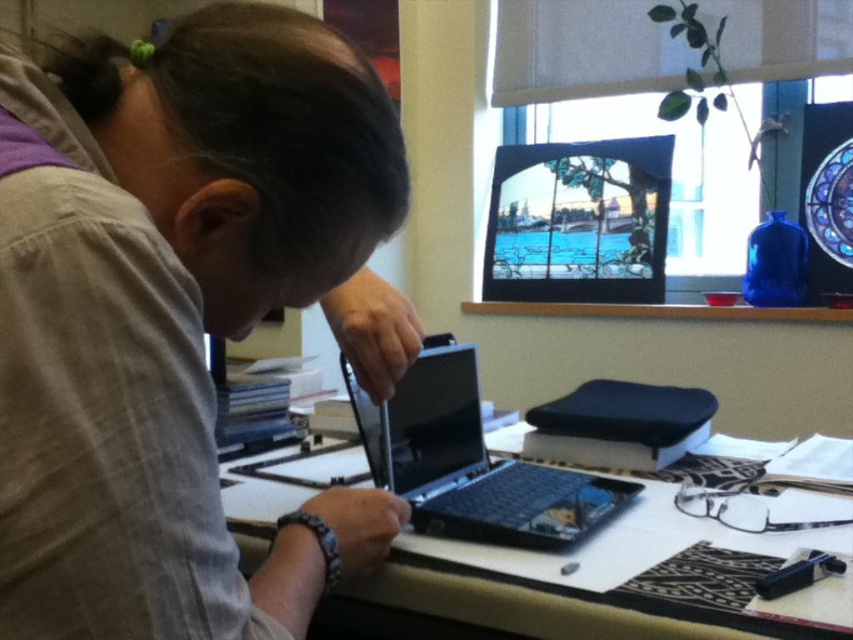
Can you confirm if black plastic laptop at center is taller than smooth wooden table at center?

Yes, black plastic laptop at center is taller than smooth wooden table at center.

Between black plastic laptop at center and smooth wooden table at center, which one has less height?

smooth wooden table at center is shorter.

Locate an element on the screen. The image size is (853, 640). black plastic laptop at center is located at coordinates (471, 461).

Where is `black plastic laptop at center`? black plastic laptop at center is located at coordinates (471, 461).

Which is more to the left, black plastic laptop at center or matte glass computer screen at upper center?

From the viewer's perspective, black plastic laptop at center appears more on the left side.

From the picture: Who is more forward, (448,428) or (663,150)?

Point (448,428) is in front.

Find the location of a particular element. black plastic laptop at center is located at coordinates (471, 461).

Does point (279, 52) lie in front of point (590, 532)?

Yes, point (279, 52) is closer to viewer.

Who is shorter, matte gray shirt at center or black plastic laptop at center?

black plastic laptop at center

Is point (144, 74) in front of point (463, 472)?

Yes, point (144, 74) is in front of point (463, 472).

In order to click on matte gray shirt at center in this screenshot , I will do `click(180, 314)`.